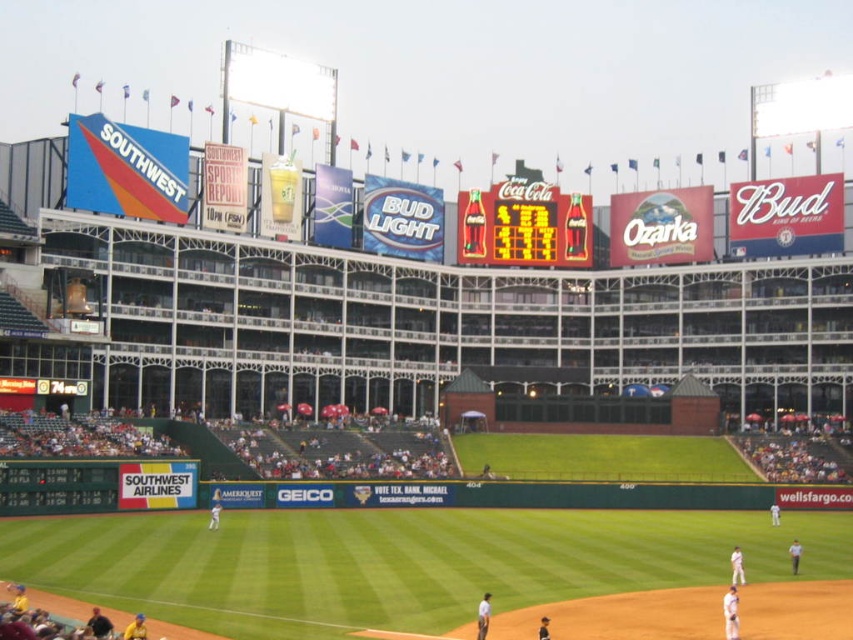
You are standing at the point marked by the coordinates (402, 563) in the baseball stadium. What do you see around you?

The point marked by the coordinates (402, 563) is green grass at center, so you are standing in the center of the baseball field on the green grass.